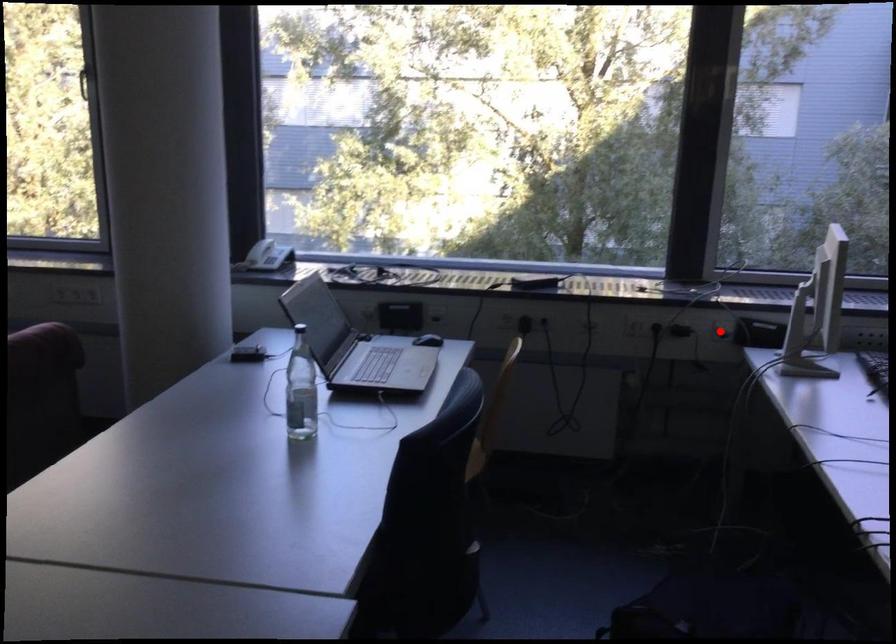
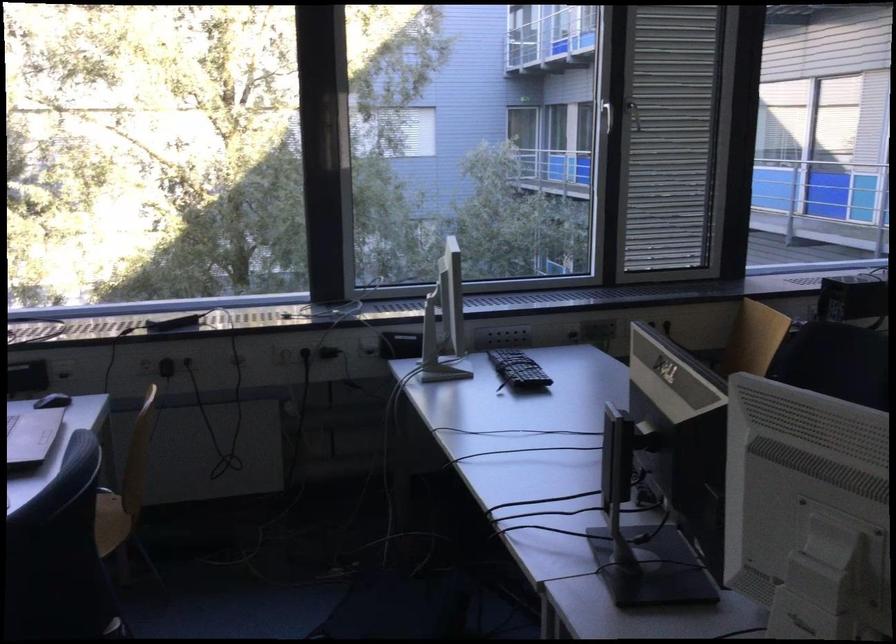
Find the pixel in the second image that matches the highlighted location in the first image.

(367, 348)